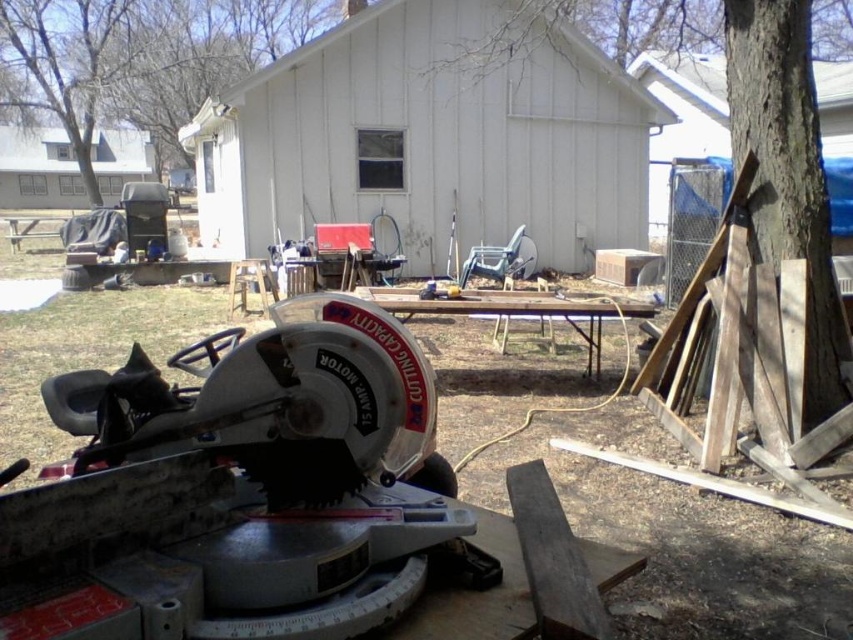
Question: Estimate the real-world distances between objects in this image. Which object is farther from the green textured tree at upper center?

Choices:
 (A) metallic gray circular saw at center
 (B) brown rough bark tree at right

Answer: (B)

Question: Which point is farther to the camera?

Choices:
 (A) brown rough bark tree at right
 (B) brown rough wood at right
 (C) green textured tree at upper center
 (D) metallic gray circular saw at center

Answer: (C)

Question: Which point is farther from the camera taking this photo?

Choices:
 (A) (792, 134)
 (B) (201, 16)
 (C) (196, 516)

Answer: (B)

Question: Does green textured tree at upper center have a larger size compared to brown rough bark tree at right?

Choices:
 (A) no
 (B) yes

Answer: (B)

Question: Is metallic gray circular saw at center above brown rough bark tree at right?

Choices:
 (A) yes
 (B) no

Answer: (B)

Question: Is metallic gray circular saw at center positioned before green textured tree at upper center?

Choices:
 (A) yes
 (B) no

Answer: (A)